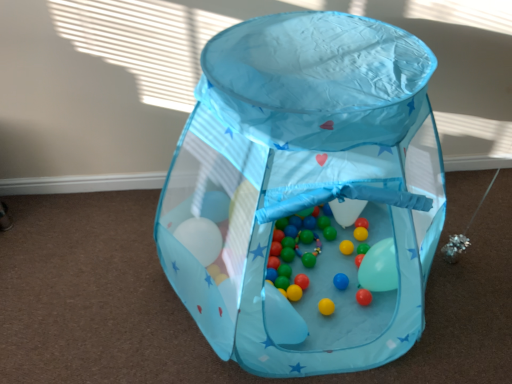
Question: Is matte plastic balls at center facing away from transparent fabric playpen at center?

Choices:
 (A) no
 (B) yes

Answer: (B)

Question: Is matte plastic balls at center surrounding transparent fabric playpen at center?

Choices:
 (A) no
 (B) yes

Answer: (A)

Question: Does matte plastic balls at center have a greater height compared to transparent fabric playpen at center?

Choices:
 (A) no
 (B) yes

Answer: (A)

Question: Considering the relative positions of matte plastic balls at center and transparent fabric playpen at center in the image provided, is matte plastic balls at center to the right of transparent fabric playpen at center from the viewer's perspective?

Choices:
 (A) no
 (B) yes

Answer: (B)

Question: Is matte plastic balls at center facing towards transparent fabric playpen at center?

Choices:
 (A) yes
 (B) no

Answer: (A)

Question: From a real-world perspective, is matte plastic balls at center under transparent fabric playpen at center?

Choices:
 (A) yes
 (B) no

Answer: (A)

Question: Is transparent fabric playpen at center with matte plastic balls at center?

Choices:
 (A) no
 (B) yes

Answer: (A)

Question: Is transparent fabric playpen at center closer to camera compared to matte plastic balls at center?

Choices:
 (A) no
 (B) yes

Answer: (B)

Question: Is transparent fabric playpen at center completely or partially outside of matte plastic balls at center?

Choices:
 (A) yes
 (B) no

Answer: (A)

Question: Considering the relative sizes of transparent fabric playpen at center and matte plastic balls at center in the image provided, is transparent fabric playpen at center wider than matte plastic balls at center?

Choices:
 (A) no
 (B) yes

Answer: (B)

Question: Can you confirm if transparent fabric playpen at center is taller than matte plastic balls at center?

Choices:
 (A) no
 (B) yes

Answer: (B)

Question: From the image's perspective, is transparent fabric playpen at center under matte plastic balls at center?

Choices:
 (A) yes
 (B) no

Answer: (B)

Question: In terms of height, does matte plastic balls at center look taller or shorter compared to transparent fabric playpen at center?

Choices:
 (A) short
 (B) tall

Answer: (A)